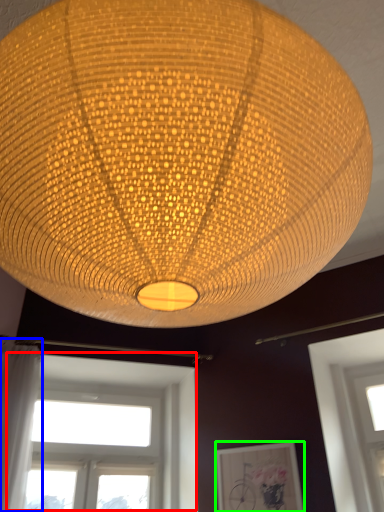
Question: Considering the real-world distances, which object is farthest from window (highlighted by a red box)? curtain (highlighted by a blue box) or picture frame (highlighted by a green box)?

Choices:
 (A) curtain
 (B) picture frame

Answer: (A)